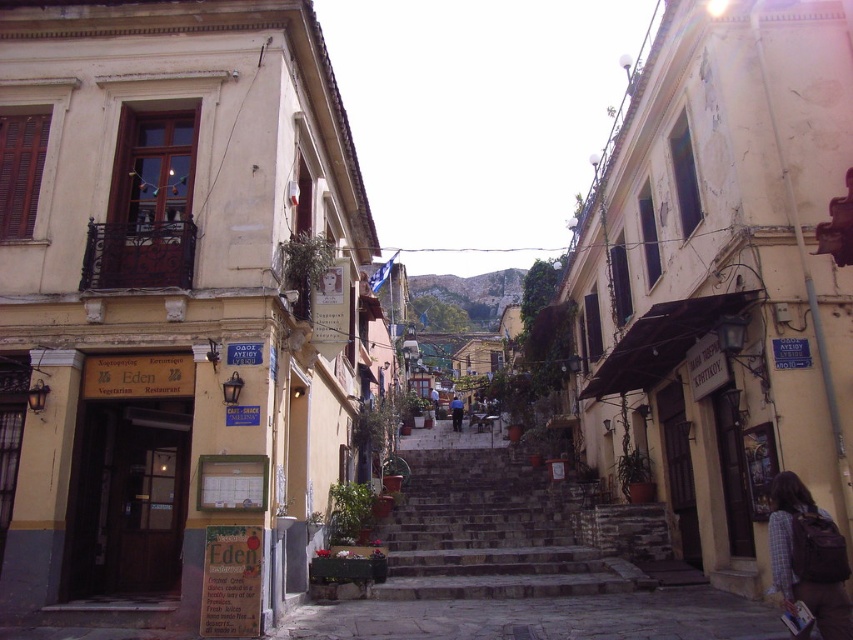
You are a tourist standing on the street looking up at the stone steps at center and the blue jeans at center. Which object is closer to you?

The stone steps at center is positioned under blue jeans at center, so the stone steps at center is closer to you.